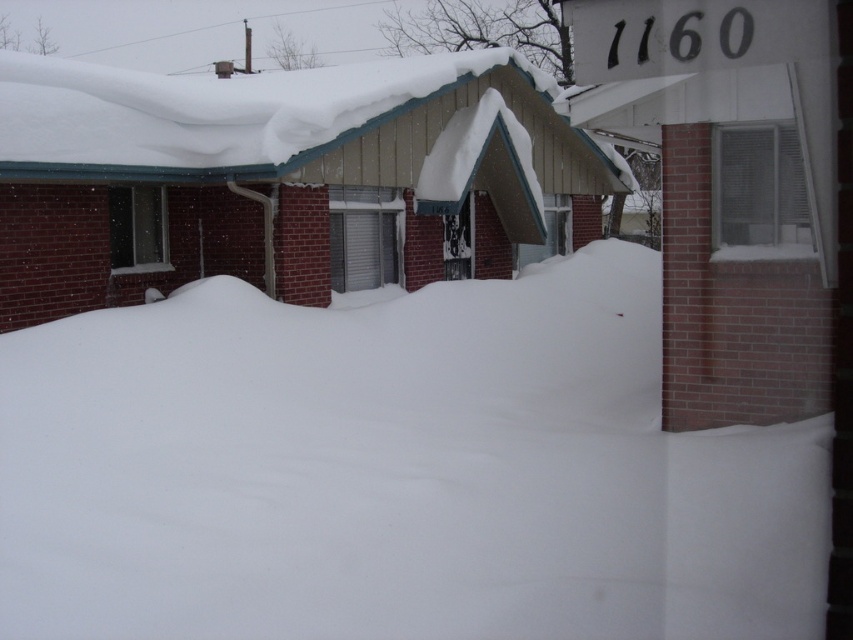
Question: Among these points, which one is farthest from the camera?

Choices:
 (A) (103, 122)
 (B) (664, 483)

Answer: (A)

Question: Can you confirm if white fluffy snow at center is positioned to the right of white shingled roof at upper center?

Choices:
 (A) yes
 (B) no

Answer: (A)

Question: Does white fluffy snow at center have a greater width compared to white shingled roof at upper center?

Choices:
 (A) yes
 (B) no

Answer: (B)

Question: Does white fluffy snow at center have a lesser width compared to white shingled roof at upper center?

Choices:
 (A) no
 (B) yes

Answer: (B)